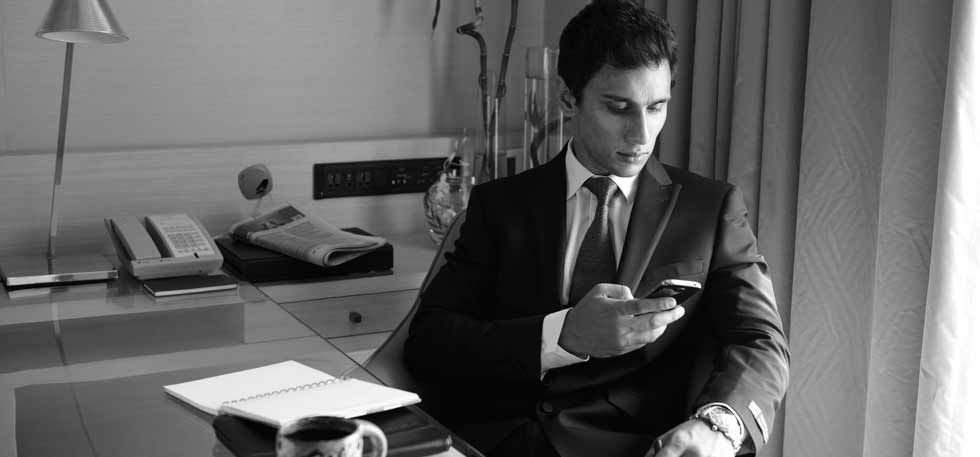
Where is `vase`? vase is located at coordinates (447, 197).